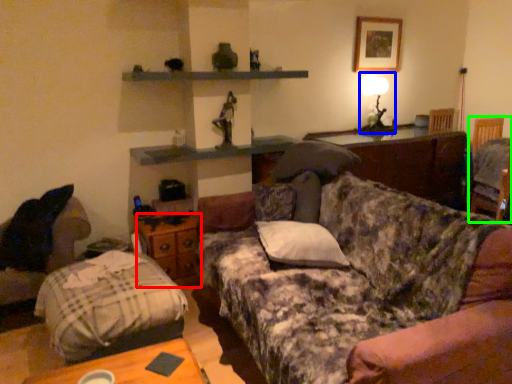
Question: Estimate the real-world distances between objects in this image. Which object is closer to drawer (highlighted by a red box), table lamp (highlighted by a blue box) or swivel chair (highlighted by a green box)?

Choices:
 (A) table lamp
 (B) swivel chair

Answer: (A)